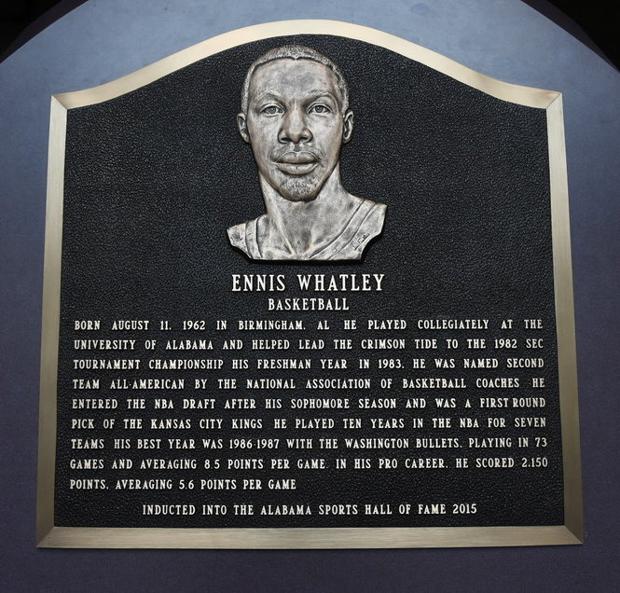
In order to click on bust of man in this screenshot , I will do `click(312, 121)`.